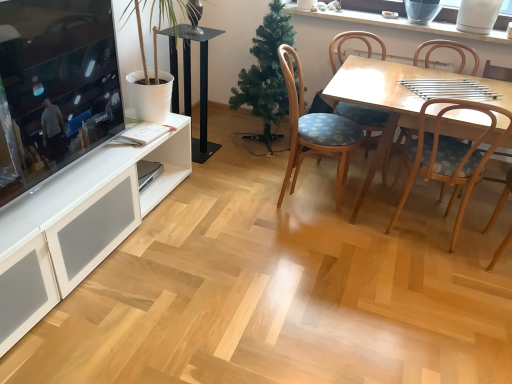
Where is `free point in front of black glass speaker at center`? free point in front of black glass speaker at center is located at coordinates [x=205, y=169].